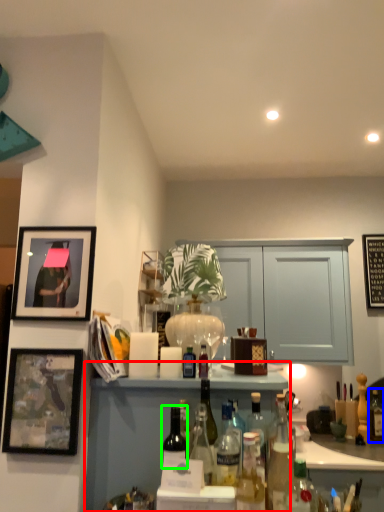
Question: Based on their relative distances, which object is farther from cabinetry (highlighted by a red box)? Choose from bottle (highlighted by a blue box) and bottle (highlighted by a green box).

Choices:
 (A) bottle
 (B) bottle

Answer: (A)